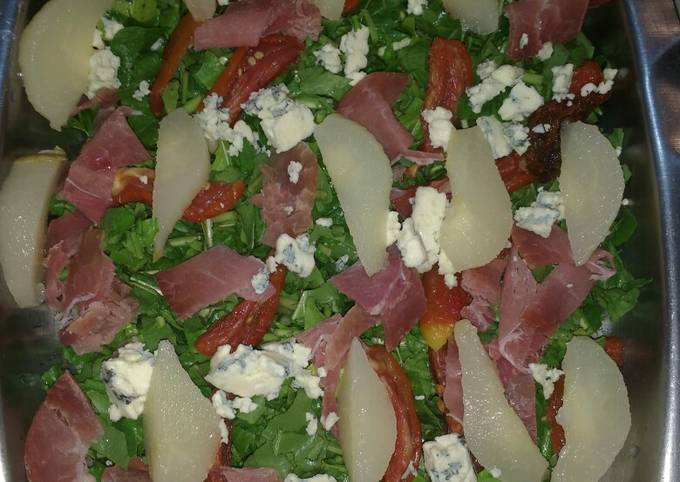
You are a GUI agent. You are given a task and a screenshot of the screen. Output one action in this format:
    pyautogui.click(x=<x>, y=<y>)
    Task: Click on the counter
    
    Given the screenshot: What is the action you would take?
    pyautogui.click(x=672, y=63)